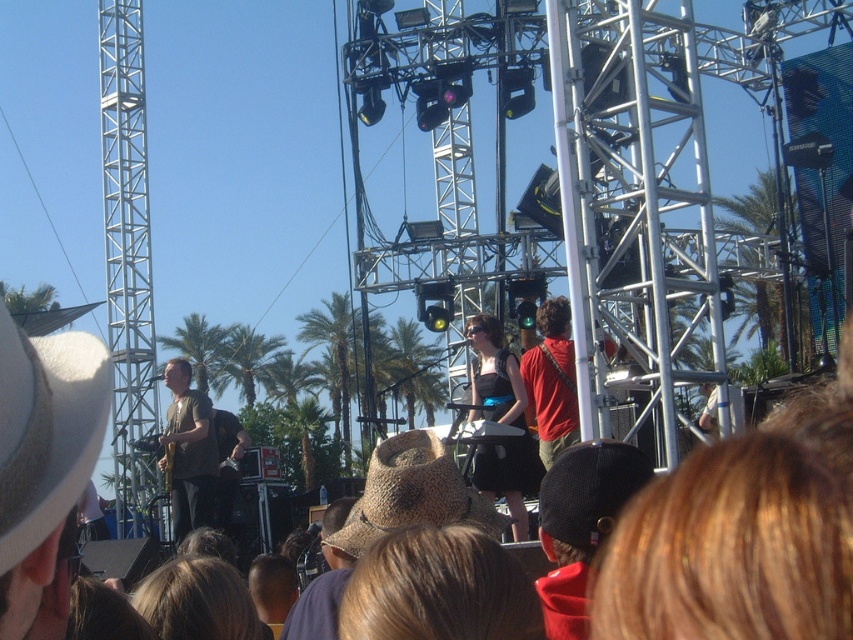
Question: Is black mesh cap at center wider than blonde hair at lower left?

Choices:
 (A) no
 (B) yes

Answer: (A)

Question: Which is nearer to the blonde hair at lower left?

Choices:
 (A) black mesh cap at center
 (B) white straw hat at left
 (C) brown straw hat at center
 (D) blonde hair at lower right

Answer: (C)

Question: Which object is the closest to the brown straw cowboy hat at center?

Choices:
 (A) black satin dress at center
 (B) blonde hair at lower right
 (C) white straw hat at left

Answer: (A)

Question: Does blonde hair at lower right appear on the right side of black satin dress at center?

Choices:
 (A) no
 (B) yes

Answer: (B)

Question: Which point is farther to the camera?

Choices:
 (A) brown straw hat at center
 (B) black satin dress at center

Answer: (B)

Question: Is black satin dress at center in front of green fabric shirt at center?

Choices:
 (A) yes
 (B) no

Answer: (A)